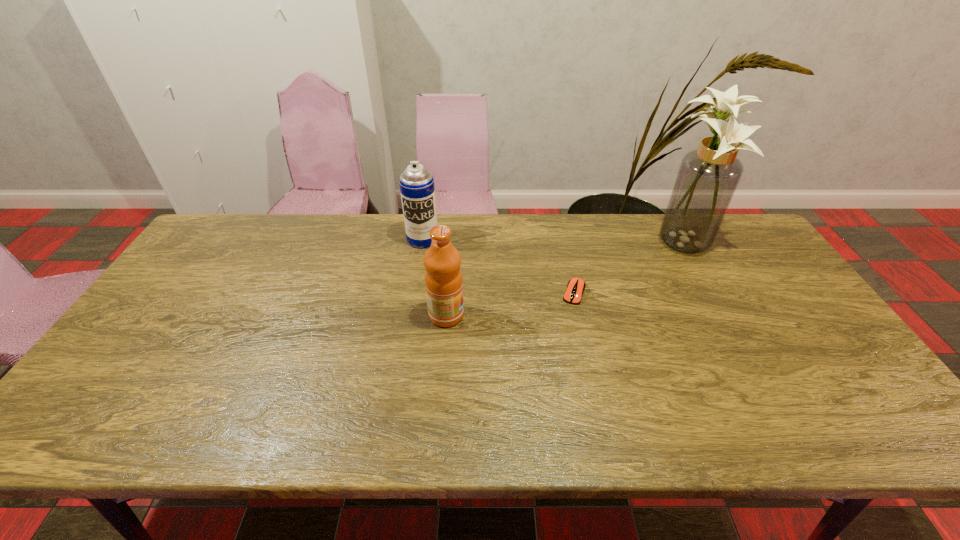
Locate an element on the screen. free area in between the fruit juice and the tallest object is located at coordinates (562, 278).

Find the location of a particular element. The height and width of the screenshot is (540, 960). empty space between the aerosol can and the tallest object is located at coordinates (550, 240).

This screenshot has width=960, height=540. In order to click on vacant area that lies between the rightmost object and the fruit juice in this screenshot , I will do `click(562, 278)`.

The height and width of the screenshot is (540, 960). I want to click on free point between the fruit juice and the shortest object, so click(510, 304).

This screenshot has width=960, height=540. In order to click on free space between the aerosol can and the flower arrangement in this screenshot , I will do `click(550, 240)`.

The width and height of the screenshot is (960, 540). In order to click on free space between the third object from left to right and the fruit juice in this screenshot , I will do `click(510, 304)`.

Identify the location of free space between the fruit juice and the computer mouse. The image size is (960, 540). (510, 304).

At what (x,y) coordinates should I click in order to perform the action: click on vacant area between the second object from right to left and the fruit juice. Please return your answer as a coordinate pair (x, y). The image size is (960, 540). Looking at the image, I should click on (510, 304).

Identify the location of vacant point located between the aerosol can and the flower arrangement. (550, 240).

Identify which object is the second nearest to the aerosol can. Please provide its 2D coordinates. Your answer should be formatted as a tuple, i.e. [(x, y)], where the tuple contains the x and y coordinates of a point satisfying the conditions above.

[(575, 288)]